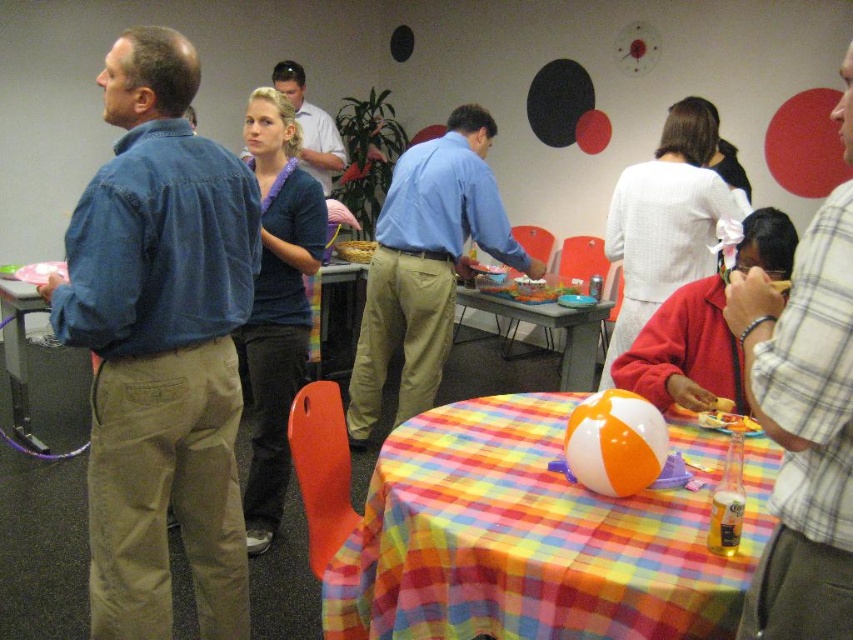
Question: Where is denim shirt at left located in relation to matte blue shirt at center in the image?

Choices:
 (A) above
 (B) below

Answer: (B)

Question: Which object is the farthest from the plastic table at center?

Choices:
 (A) matte blue shirt at center
 (B) matte brown cake at center
 (C) orange/beach ball at center

Answer: (C)

Question: Does plaid shirt at right have a larger size compared to plastic table at center?

Choices:
 (A) no
 (B) yes

Answer: (A)

Question: Which object appears closest to the camera in this image?

Choices:
 (A) plaid shirt at right
 (B) matte blue shirt at center

Answer: (A)

Question: Which point is farther from the camera taking this photo?

Choices:
 (A) (376, 236)
 (B) (641, 436)
 (C) (206, 611)

Answer: (A)

Question: Is plaid fabric tablecloth at lower center thinner than plaid shirt at right?

Choices:
 (A) yes
 (B) no

Answer: (B)